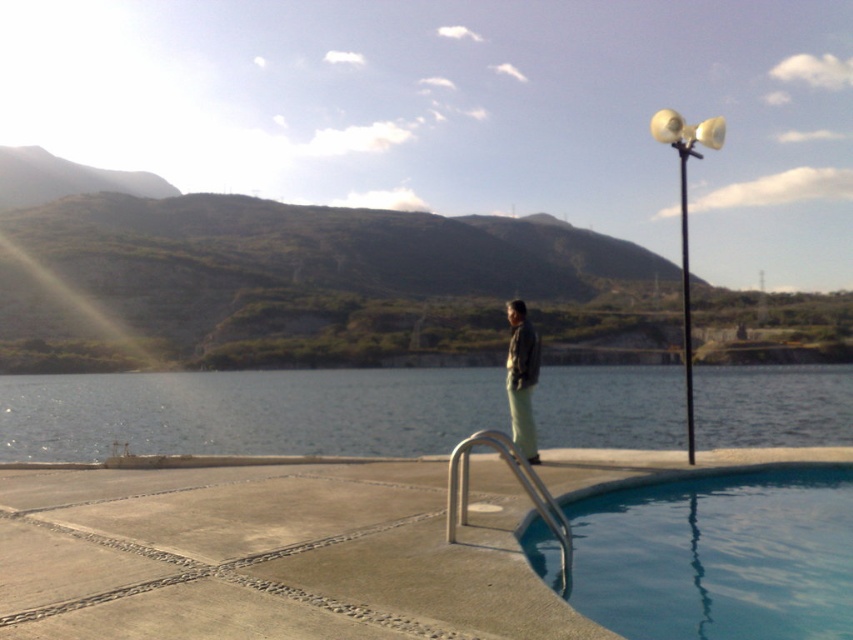
You are standing on the pool deck and want to walk from the blue smooth water at lower right to the clear water at pool right. Which direction should you move to reach your destination?

You should move to the right because the clear water at pool right is located to the right of the blue smooth water at lower right.